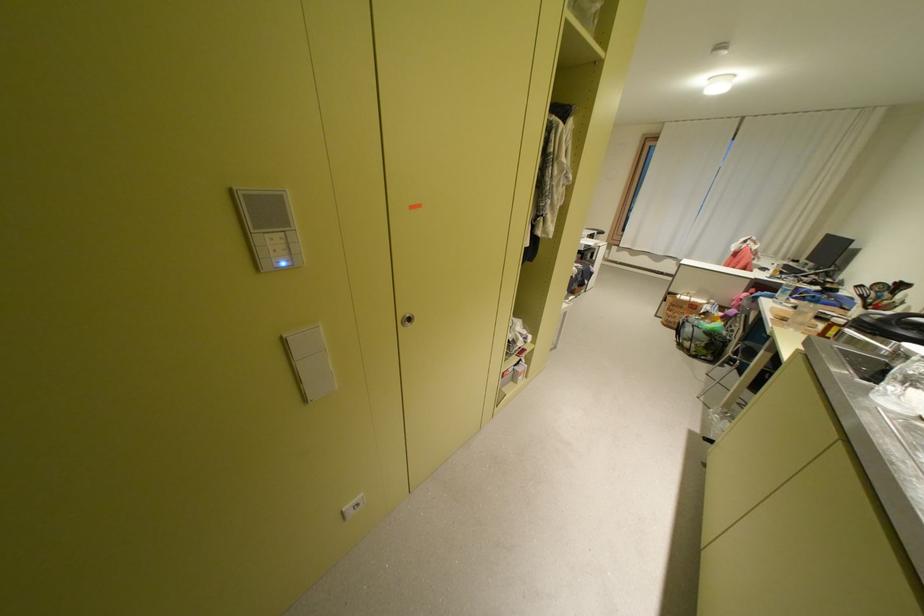
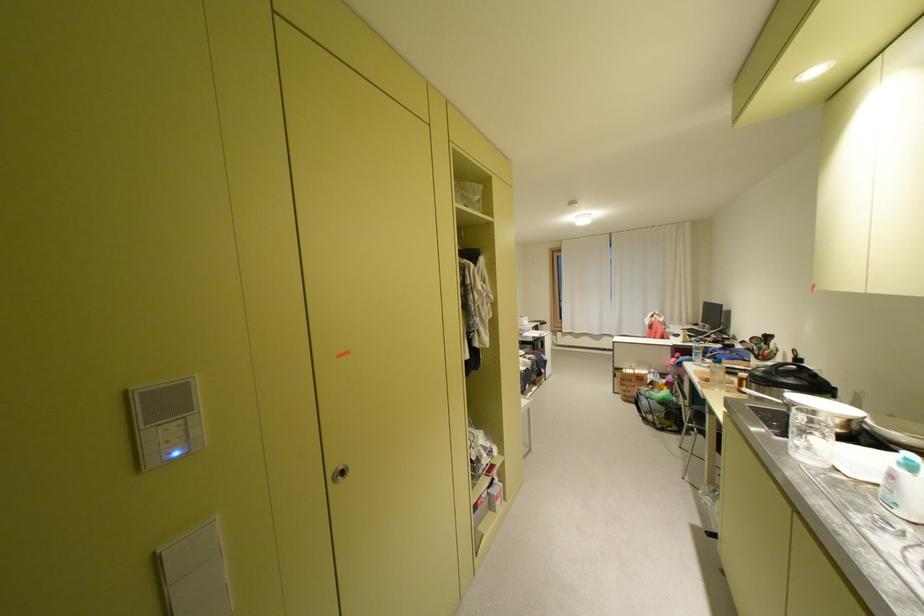
The point at (289, 262) is marked in the first image. Where is the corresponding point in the second image?

(180, 455)